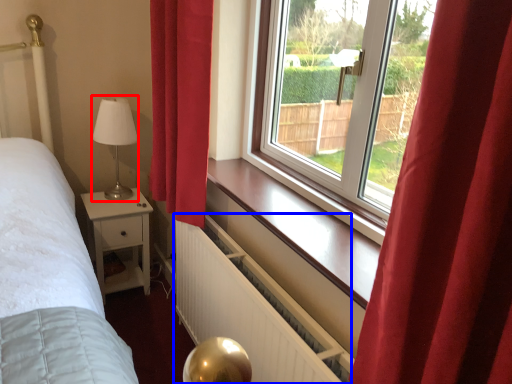
Question: Among these objects, which one is nearest to the camera, table lamp (highlighted by a red box) or radiator (highlighted by a blue box)?

Choices:
 (A) table lamp
 (B) radiator

Answer: (B)